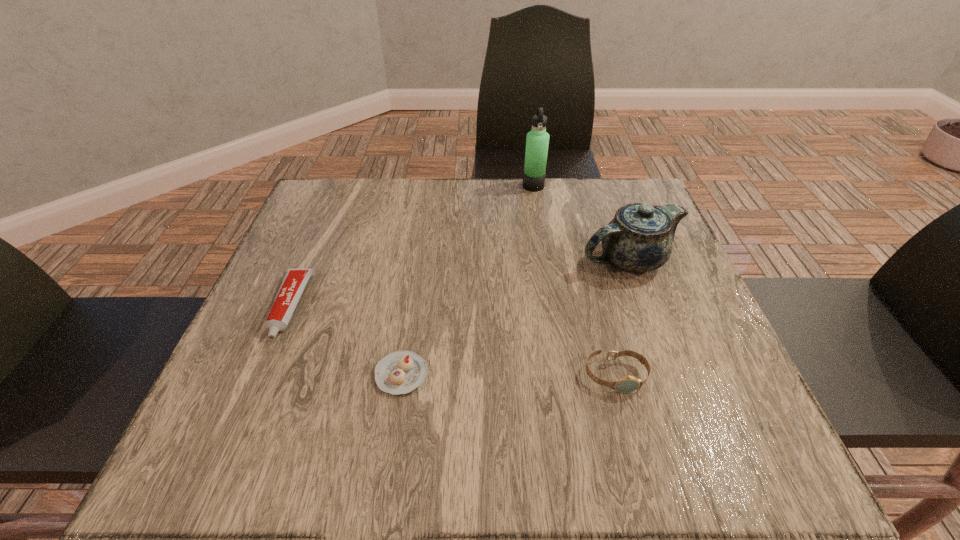
Image resolution: width=960 pixels, height=540 pixels. I want to click on vacant space located 0.060m on the face of the watch, so click(629, 427).

Find the location of a particular element. vacant space located 0.160m at the nozzle of the leftmost object is located at coordinates (241, 424).

Where is `vacant space situated on the right of the cupcake`? This screenshot has width=960, height=540. vacant space situated on the right of the cupcake is located at coordinates (462, 374).

Find the location of a particular element. Image resolution: width=960 pixels, height=540 pixels. object at the far edge is located at coordinates (537, 141).

You are a GUI agent. You are given a task and a screenshot of the screen. Output one action in this format:
    pyautogui.click(x=<x>, y=<y>)
    Task: Click on the object that is at the left edge
    
    Given the screenshot: What is the action you would take?
    pyautogui.click(x=294, y=281)

Locate an element on the screen. The height and width of the screenshot is (540, 960). chinaware that is at the right edge is located at coordinates (639, 238).

Where is `watch situated at the right edge`? Image resolution: width=960 pixels, height=540 pixels. watch situated at the right edge is located at coordinates (626, 384).

At what (x,y) coordinates should I click in order to perform the action: click on free region at the far edge. Please return your answer as a coordinate pair (x, y). Looking at the image, I should click on (468, 191).

At what (x,y) coordinates should I click in order to perform the action: click on vacant space at the near edge. Please return your answer as a coordinate pair (x, y). Looking at the image, I should click on (496, 432).

Identify the location of vacant area at the left edge of the desktop. (347, 263).